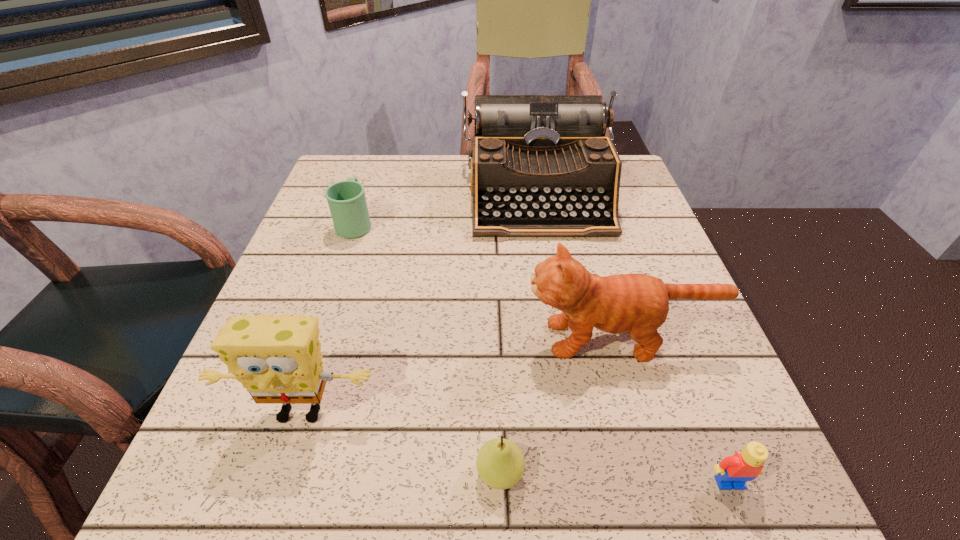
Where is `typewriter`? The image size is (960, 540). typewriter is located at coordinates (541, 166).

What are the coordinates of `the fourth nearest object` in the screenshot? It's located at (637, 303).

The height and width of the screenshot is (540, 960). What are the coordinates of `the third nearest object` in the screenshot? It's located at (278, 359).

Locate an element on the screen. mug is located at coordinates (346, 199).

Locate an element on the screen. The image size is (960, 540). Lego is located at coordinates (734, 471).

Locate an element on the screen. This screenshot has height=540, width=960. pear is located at coordinates (500, 463).

At what (x,y) coordinates should I click in order to perform the action: click on free space located 0.310m on the keyboard of the typewriter. Please return your answer as a coordinate pair (x, y). The width and height of the screenshot is (960, 540). Looking at the image, I should click on (566, 353).

I want to click on vacant space situated 0.300m on the face of the cat, so click(356, 339).

Where is `free location located on the face of the cat`? This screenshot has height=540, width=960. free location located on the face of the cat is located at coordinates (446, 339).

Identify the location of vacant space positioned 0.260m on the face of the cat. The image size is (960, 540). (379, 339).